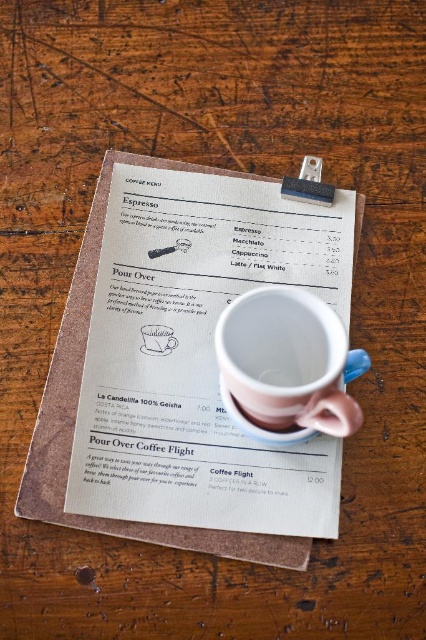
Looking at this image, you are a barista preparing a coffee order. You have a pink matte mug at center and a pink matte saucer at center on the table. Where should you place the coffee to ensure it stays warm?

The pink matte mug at center should be placed over the pink matte saucer at center to keep the coffee warm, as the saucer acts as a base to catch drips and the mug holds the beverage.